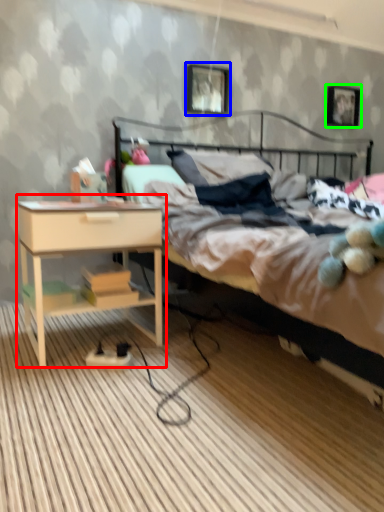
Question: Considering the real-world distances, which object is farthest from nightstand (highlighted by a red box)? picture frame (highlighted by a blue box) or picture frame (highlighted by a green box)?

Choices:
 (A) picture frame
 (B) picture frame

Answer: (B)